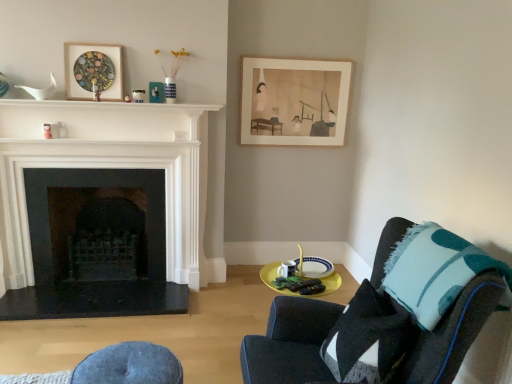
Where is `empty space that is ontop of white glossy fireplace at left, the first fireplace positioned from the front (from a real-world perspective)`? empty space that is ontop of white glossy fireplace at left, the first fireplace positioned from the front (from a real-world perspective) is located at coordinates (92, 111).